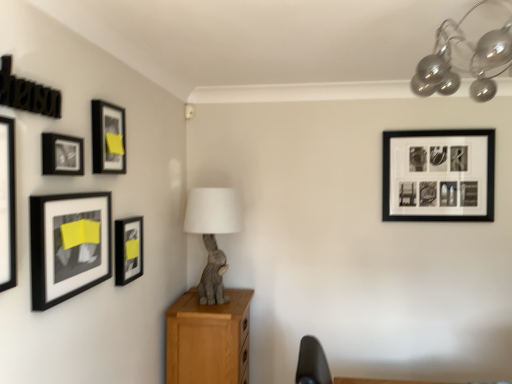
Locate an element on the screen. This screenshot has height=384, width=512. wooden cabinet at center is located at coordinates (207, 339).

What do you see at coordinates (128, 249) in the screenshot? I see `matte black picture frame at left, the 5th picture frame in the front-to-back sequence` at bounding box center [128, 249].

What do you see at coordinates (438, 175) in the screenshot? I see `black matte picture frame at upper right, positioned as the sixth picture frame in front-to-back order` at bounding box center [438, 175].

Image resolution: width=512 pixels, height=384 pixels. What do you see at coordinates (68, 245) in the screenshot?
I see `matte black picture frame at left, the third picture frame positioned from the left` at bounding box center [68, 245].

In order to click on matte black picture frame at left, the first picture frame in the left-to-right sequence in this screenshot , I will do `click(7, 204)`.

Identify the location of gray fabric rabbit at center. This screenshot has height=384, width=512. (213, 234).

Is the depth of black matte picture frame at upper right, the 6th picture frame from the left, greater than that of wooden cabinet at center?

Yes, the depth of black matte picture frame at upper right, the 6th picture frame from the left, is greater than that of wooden cabinet at center.

From a real-world perspective, between black matte picture frame at upper right, the 6th picture frame from the left, and wooden cabinet at center, who is vertically higher?

black matte picture frame at upper right, the 6th picture frame from the left, from a real-world perspective.

Is point (490, 216) positioned behind point (192, 308)?

Yes, it is.

Based on their positions, is matte black picture frame at left, arranged as the fifth picture frame when viewed from the back, located to the left or right of matte black picture frame at left, placed as the 1th picture frame when sorted from front to back?

In the image, matte black picture frame at left, arranged as the fifth picture frame when viewed from the back, appears on the right side of matte black picture frame at left, placed as the 1th picture frame when sorted from front to back.

What's the angular difference between matte black picture frame at left, the fourth picture frame in the right-to-left sequence, and matte black picture frame at left, which appears as the 6th picture frame when viewed from the right,'s facing directions?

0.000664 degrees.

From the picture: Is matte black picture frame at left, arranged as the fifth picture frame when viewed from the back, thinner than matte black picture frame at left, placed as the 1th picture frame when sorted from front to back?

Indeed, matte black picture frame at left, arranged as the fifth picture frame when viewed from the back, has a lesser width compared to matte black picture frame at left, placed as the 1th picture frame when sorted from front to back.

In terms of height, does matte black picture frame at left, the fourth picture frame in the right-to-left sequence, look taller or shorter compared to matte black picture frame at left, which appears as the 6th picture frame when viewed from the right?

Considering their sizes, matte black picture frame at left, the fourth picture frame in the right-to-left sequence, has less height than matte black picture frame at left, which appears as the 6th picture frame when viewed from the right.

Which point is more distant from viewer, [122,219] or [10,149]?

The point [122,219] is farther from the camera.

There is a matte black picture frame at left, acting as the 2th picture frame starting from the right. What are the coordinates of `the 2nd picture frame above it (from the image's perspective)` in the screenshot? It's located at (7, 204).

In the scene shown: Is matte black picture frame at left, acting as the 2th picture frame starting from the right, turned away from matte black picture frame at left, the first picture frame in the left-to-right sequence?

That's not correct — matte black picture frame at left, acting as the 2th picture frame starting from the right, is not looking away from matte black picture frame at left, the first picture frame in the left-to-right sequence.

Does matte black picture frame at left, the 5th picture frame in the front-to-back sequence, come behind matte black picture frame at left, the first picture frame in the left-to-right sequence?

Yes, it is.

Relative to matte black picture frame at upper left, the 3th picture frame positioned from the back, is matte black picture frame at left, the 5th picture frame in the front-to-back sequence, in front or behind?

matte black picture frame at left, the 5th picture frame in the front-to-back sequence, is behind matte black picture frame at upper left, the 3th picture frame positioned from the back.

From the image's perspective, is matte black picture frame at left, the 2th picture frame positioned from the back, above or below matte black picture frame at upper left, which is the 4th picture frame in left-to-right order?

Clearly, from the image's perspective, matte black picture frame at left, the 2th picture frame positioned from the back, is below matte black picture frame at upper left, which is the 4th picture frame in left-to-right order.

Visually, is matte black picture frame at left, which is counted as the fifth picture frame, starting from the left, positioned to the left or to the right of matte black picture frame at upper left, the 3th picture frame positioned from the back?

Based on their positions, matte black picture frame at left, which is counted as the fifth picture frame, starting from the left, is located to the right of matte black picture frame at upper left, the 3th picture frame positioned from the back.

Is matte black picture frame at left, acting as the 2th picture frame starting from the right, situated inside matte black picture frame at upper left, which is the 4th picture frame in left-to-right order, or outside?

matte black picture frame at left, acting as the 2th picture frame starting from the right, exists outside the volume of matte black picture frame at upper left, which is the 4th picture frame in left-to-right order.

From the image's perspective, is black matte picture frame at upper right, positioned as the sixth picture frame in front-to-back order, positioned above or below matte black picture frame at upper left, which appears as the 5th picture frame when viewed from the right?

black matte picture frame at upper right, positioned as the sixth picture frame in front-to-back order, is situated lower than matte black picture frame at upper left, which appears as the 5th picture frame when viewed from the right, in the image.

From a real-world perspective, who is located higher, black matte picture frame at upper right, positioned as the sixth picture frame in front-to-back order, or matte black picture frame at upper left, which appears as the 5th picture frame when viewed from the right?

matte black picture frame at upper left, which appears as the 5th picture frame when viewed from the right, is physically above.

Considering the relative positions of black matte picture frame at upper right, the 6th picture frame from the left, and matte black picture frame at upper left, the third picture frame positioned from the front, in the image provided, is black matte picture frame at upper right, the 6th picture frame from the left, behind matte black picture frame at upper left, the third picture frame positioned from the front,?

Yes.

Between black matte picture frame at upper right, positioned as the sixth picture frame in front-to-back order, and matte black picture frame at upper left, which is the 4th picture frame in back-to-front order, which one has larger size?

black matte picture frame at upper right, positioned as the sixth picture frame in front-to-back order, is bigger.

You are a GUI agent. You are given a task and a screenshot of the screen. Output one action in this format:
    pyautogui.click(x=<x>, y=<y>)
    Task: Click on the picture frame that is the 3rd one when counting upward from the matte black picture frame at left, the 2th picture frame positioned from the back (from the image's perspective)
    This screenshot has width=512, height=384.
    Given the screenshot: What is the action you would take?
    pyautogui.click(x=438, y=175)

Is matte black picture frame at left, the 2th picture frame positioned from the back, located outside black matte picture frame at upper right, the 6th picture frame from the left?

Yes, matte black picture frame at left, the 2th picture frame positioned from the back, is located beyond the bounds of black matte picture frame at upper right, the 6th picture frame from the left.

Is matte black picture frame at left, the 2th picture frame positioned from the back, smaller than black matte picture frame at upper right, marked as the first picture frame in a back-to-front arrangement?

Yes.

Considering the sizes of objects matte black picture frame at left, acting as the 2th picture frame starting from the right, and black matte picture frame at upper right, positioned as the 1th picture frame in right-to-left order, in the image provided, who is wider, matte black picture frame at left, acting as the 2th picture frame starting from the right, or black matte picture frame at upper right, positioned as the 1th picture frame in right-to-left order,?

Wider between the two is black matte picture frame at upper right, positioned as the 1th picture frame in right-to-left order.

Considering the relative sizes of matte black picture frame at upper left, which is the 4th picture frame in left-to-right order, and metallic glass chandelier at upper right in the image provided, is matte black picture frame at upper left, which is the 4th picture frame in left-to-right order, wider than metallic glass chandelier at upper right?

No, matte black picture frame at upper left, which is the 4th picture frame in left-to-right order, is not wider than metallic glass chandelier at upper right.

In the scene shown: From a real-world perspective, who is located higher, matte black picture frame at upper left, the 3th picture frame positioned from the back, or metallic glass chandelier at upper right?

From a 3D spatial view, metallic glass chandelier at upper right is above.

Considering the relative sizes of matte black picture frame at upper left, arranged as the 4th picture frame when viewed from the front, and metallic glass chandelier at upper right in the image provided, is matte black picture frame at upper left, arranged as the 4th picture frame when viewed from the front, bigger than metallic glass chandelier at upper right?

No, matte black picture frame at upper left, arranged as the 4th picture frame when viewed from the front, is not bigger than metallic glass chandelier at upper right.

In the image, is matte black picture frame at upper left, the 3th picture frame positioned from the back, positioned in front of or behind metallic glass chandelier at upper right?

matte black picture frame at upper left, the 3th picture frame positioned from the back, is behind metallic glass chandelier at upper right.

The height and width of the screenshot is (384, 512). In order to click on table in front of the black matte picture frame at upper right, positioned as the sixth picture frame in front-to-back order in this screenshot , I will do `click(207, 339)`.

Locate an element on the screen. the 1st picture frame positioned above the matte black picture frame at left, the 2th picture frame positioned from the front (from a real-world perspective) is located at coordinates (7, 204).

When comparing their distances from matte black picture frame at upper left, which ranks as the third picture frame in right-to-left order, does metallic glass chandelier at upper right or matte black picture frame at left, the 2th picture frame positioned from the back, seem further?

Based on the image, metallic glass chandelier at upper right appears to be further to matte black picture frame at upper left, which ranks as the third picture frame in right-to-left order.

When comparing their distances from black matte picture frame at upper right, the 6th picture frame from the left, does matte black picture frame at left, which is counted as the fifth picture frame, starting from the left, or matte black picture frame at left, the first picture frame in the left-to-right sequence, seem further?

Based on the image, matte black picture frame at left, the first picture frame in the left-to-right sequence, appears to be further to black matte picture frame at upper right, the 6th picture frame from the left.

Estimate the real-world distances between objects in this image. Which object is further from metallic glass chandelier at upper right, wooden cabinet at center or matte black picture frame at left, which appears as the 6th picture frame when viewed from the right?

wooden cabinet at center lies further to metallic glass chandelier at upper right than the other object.

When comparing their distances from matte black picture frame at left, the 2th picture frame positioned from the back, does matte black picture frame at left, placed as the 1th picture frame when sorted from front to back, or matte black picture frame at upper left, the 3th picture frame positioned from the back, seem further?

matte black picture frame at left, placed as the 1th picture frame when sorted from front to back, is positioned further to the anchor matte black picture frame at left, the 2th picture frame positioned from the back.

Considering their positions, is wooden cabinet at center positioned further to matte black picture frame at upper left, arranged as the 4th picture frame when viewed from the front, than gray fabric rabbit at center?

The object further to matte black picture frame at upper left, arranged as the 4th picture frame when viewed from the front, is wooden cabinet at center.

Based on their spatial positions, is black matte picture frame at upper right, positioned as the 1th picture frame in right-to-left order, or matte black picture frame at upper left, which is the 4th picture frame in back-to-front order, closer to wooden cabinet at center?

matte black picture frame at upper left, which is the 4th picture frame in back-to-front order, is positioned closer to the anchor wooden cabinet at center.

Considering their positions, is matte black picture frame at upper left, which appears as the 5th picture frame when viewed from the right, positioned closer to gray fabric rabbit at center than wooden cabinet at center?

wooden cabinet at center lies closer to gray fabric rabbit at center than the other object.

Estimate the real-world distances between objects in this image. Which object is further from matte black picture frame at upper left, arranged as the 4th picture frame when viewed from the front, wooden cabinet at center or matte black picture frame at upper left, which is the 4th picture frame in back-to-front order?

wooden cabinet at center lies further to matte black picture frame at upper left, arranged as the 4th picture frame when viewed from the front, than the other object.

This screenshot has height=384, width=512. I want to click on lamp located between matte black picture frame at upper left, which appears as the 5th picture frame when viewed from the right, and black matte picture frame at upper right, positioned as the sixth picture frame in front-to-back order, in the left-right direction, so click(x=468, y=63).

What are the coordinates of `table lamp between matte black picture frame at left, marked as the 6th picture frame in a back-to-front arrangement, and black matte picture frame at upper right, positioned as the 1th picture frame in right-to-left order, in the front-back direction` in the screenshot? It's located at (213, 234).

At what (x,y) coordinates should I click in order to perform the action: click on table positioned between matte black picture frame at left, the first picture frame in the left-to-right sequence, and gray fabric rabbit at center from near to far. Please return your answer as a coordinate pair (x, y). Looking at the image, I should click on (x=207, y=339).

The width and height of the screenshot is (512, 384). What are the coordinates of `picture frame between matte black picture frame at upper left, which is the 4th picture frame in left-to-right order, and metallic glass chandelier at upper right from left to right` in the screenshot? It's located at (128, 249).